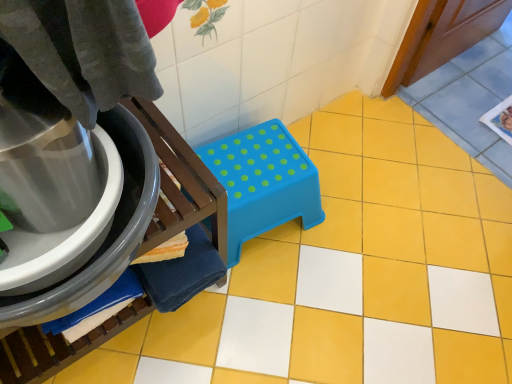
The width and height of the screenshot is (512, 384). What do you see at coordinates (181, 183) in the screenshot? I see `blue plastic stool at center` at bounding box center [181, 183].

This screenshot has width=512, height=384. In order to click on blue plastic stool at center in this screenshot , I will do `click(181, 183)`.

What do you see at coordinates (263, 182) in the screenshot?
I see `blue plastic step stool at center` at bounding box center [263, 182].

Find the location of a particular element. Image resolution: width=512 pixels, height=384 pixels. blue plastic step stool at center is located at coordinates click(263, 182).

Identify the location of blue plastic stool at center. This screenshot has width=512, height=384. (181, 183).

Which object is positioned more to the right, blue plastic stool at center or blue plastic step stool at center?

blue plastic step stool at center.

Is blue plastic stool at center in front of or behind blue plastic step stool at center in the image?

blue plastic stool at center is in front of blue plastic step stool at center.

Is point (212, 216) more distant than point (249, 135)?

No, (212, 216) is closer to viewer.

From the image's perspective, which is below, blue plastic stool at center or blue plastic step stool at center?

blue plastic stool at center, from the image's perspective.

From a real-world perspective, does blue plastic stool at center sit lower than blue plastic step stool at center?

No, from a real-world perspective, blue plastic stool at center is not under blue plastic step stool at center.

Considering the sizes of objects blue plastic stool at center and blue plastic step stool at center in the image provided, who is wider, blue plastic stool at center or blue plastic step stool at center?

With larger width is blue plastic stool at center.

Considering the sizes of blue plastic stool at center and blue plastic step stool at center in the image, is blue plastic stool at center taller or shorter than blue plastic step stool at center?

blue plastic stool at center is taller than blue plastic step stool at center.

Is blue plastic stool at center bigger than blue plastic step stool at center?

Yes.

Is blue plastic stool at center surrounding blue plastic step stool at center?

No, blue plastic step stool at center is located outside of blue plastic stool at center.

Is blue plastic stool at center not near blue plastic step stool at center?

blue plastic stool at center is actually quite close to blue plastic step stool at center.

Is blue plastic stool at center positioned with its back to blue plastic step stool at center?

No.

Based on the photo, can you tell me how much blue plastic stool at center and blue plastic step stool at center differ in facing direction?

1.44 degrees separate the facing orientations of blue plastic stool at center and blue plastic step stool at center.

Image resolution: width=512 pixels, height=384 pixels. Find the location of `step stool above the blue plastic stool at center (from the image's perspective)`. step stool above the blue plastic stool at center (from the image's perspective) is located at coordinates (263, 182).

Does blue plastic step stool at center appear on the right side of blue plastic stool at center?

Yes, blue plastic step stool at center is to the right of blue plastic stool at center.

In the image, is blue plastic step stool at center positioned in front of or behind blue plastic stool at center?

Clearly, blue plastic step stool at center is behind blue plastic stool at center.

Is point (290, 202) less distant than point (195, 184)?

No, it is behind (195, 184).

From the image's perspective, relative to blue plastic stool at center, is blue plastic step stool at center above or below?

blue plastic step stool at center is situated higher than blue plastic stool at center in the image.

From a real-world perspective, is blue plastic step stool at center positioned above or below blue plastic stool at center?

blue plastic step stool at center is below blue plastic stool at center.

Is blue plastic step stool at center wider than blue plastic stool at center?

No.

Is blue plastic step stool at center taller than blue plastic stool at center?

No, blue plastic step stool at center is not taller than blue plastic stool at center.

In terms of size, does blue plastic step stool at center appear bigger or smaller than blue plastic stool at center?

blue plastic step stool at center is smaller than blue plastic stool at center.

Would you say blue plastic step stool at center is inside or outside blue plastic stool at center?

blue plastic step stool at center cannot be found inside blue plastic stool at center.

Is blue plastic step stool at center next to blue plastic stool at center?

No, blue plastic step stool at center is not beside blue plastic stool at center.

Is blue plastic step stool at center aimed at blue plastic stool at center?

No, blue plastic step stool at center is not aimed at blue plastic stool at center.

How different are the orientations of blue plastic step stool at center and blue plastic stool at center in degrees?

The facing directions of blue plastic step stool at center and blue plastic stool at center are 1.44 degrees apart.

From the picture: Measure the distance between blue plastic step stool at center and blue plastic stool at center.

blue plastic step stool at center is 11.84 inches from blue plastic stool at center.

Find the location of a particular element. furniture located in front of the blue plastic step stool at center is located at coordinates (181, 183).

Find the location of a particular element. Image resolution: width=512 pixels, height=384 pixels. step stool above the blue plastic stool at center (from the image's perspective) is located at coordinates (263, 182).

The image size is (512, 384). I want to click on furniture below the blue plastic step stool at center (from the image's perspective), so click(x=181, y=183).